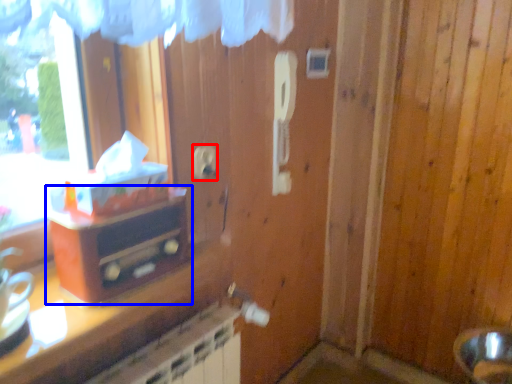
Question: Which object is further to the camera taking this photo, electric outlet (highlighted by a red box) or furniture (highlighted by a blue box)?

Choices:
 (A) electric outlet
 (B) furniture

Answer: (A)